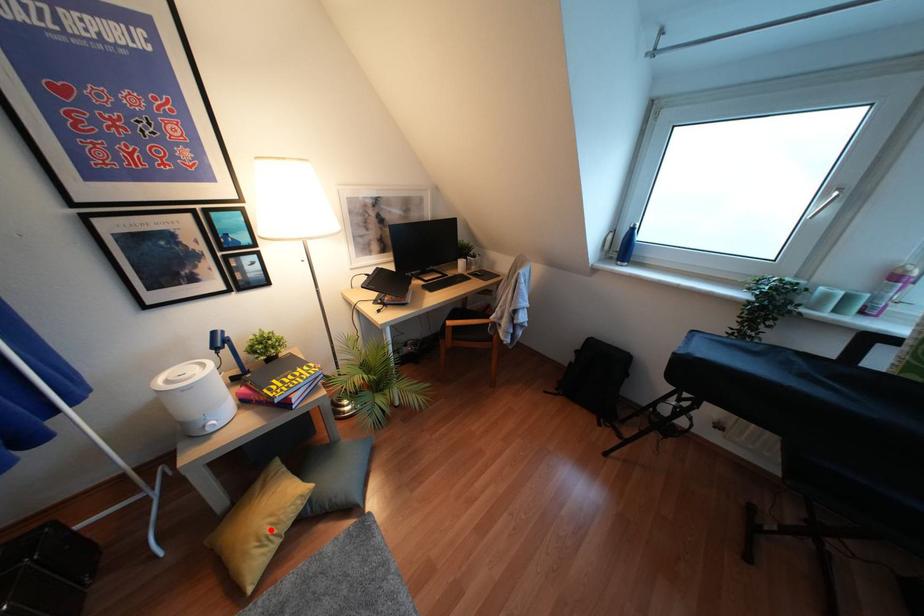
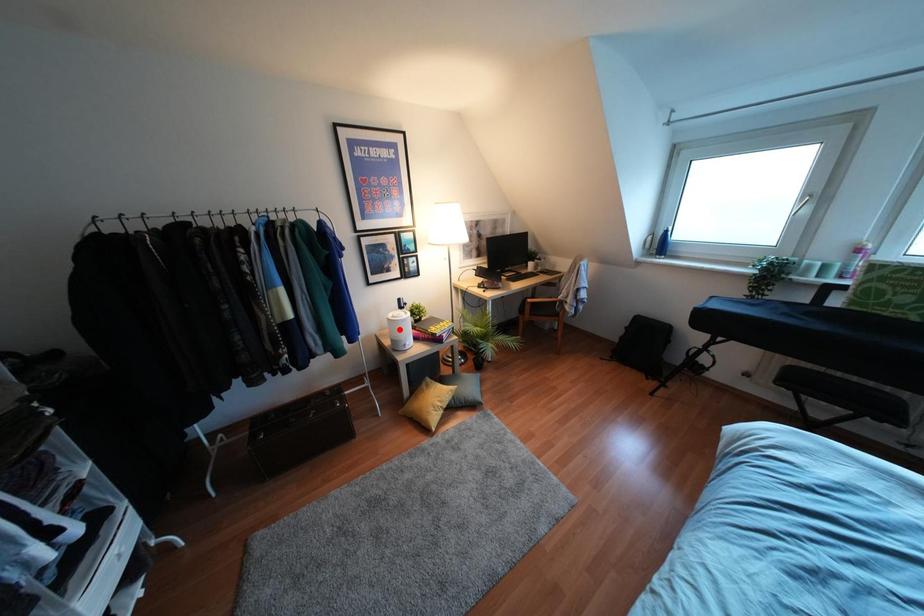
I am providing you with two images of the same scene from different viewpoints. A red point is marked on the first image and another point is marked on the second image. Is the red point in image1 aligned with the point shown in image2?

No